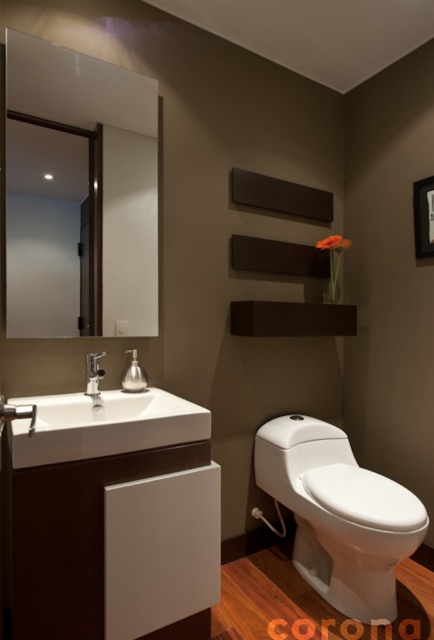
You are a cleaning robot with a width of 2 feet. You need to move from the clear glass mirror at upper left to the white glossy toilet at lower right. Is there enough space between them for you to pass through?

The clear glass mirror at upper left is 3.36 feet from the white glossy toilet at lower right, so yes, the robot can pass through since the distance is greater than its 2 feet width.

You are standing in the bathroom and want to check your reflection in the clear glass mirror at upper left. Where exactly should you look to see your reflection?

To see your reflection in the clear glass mirror at upper left, you should look at the point located at coordinates (78, 193) in the image.